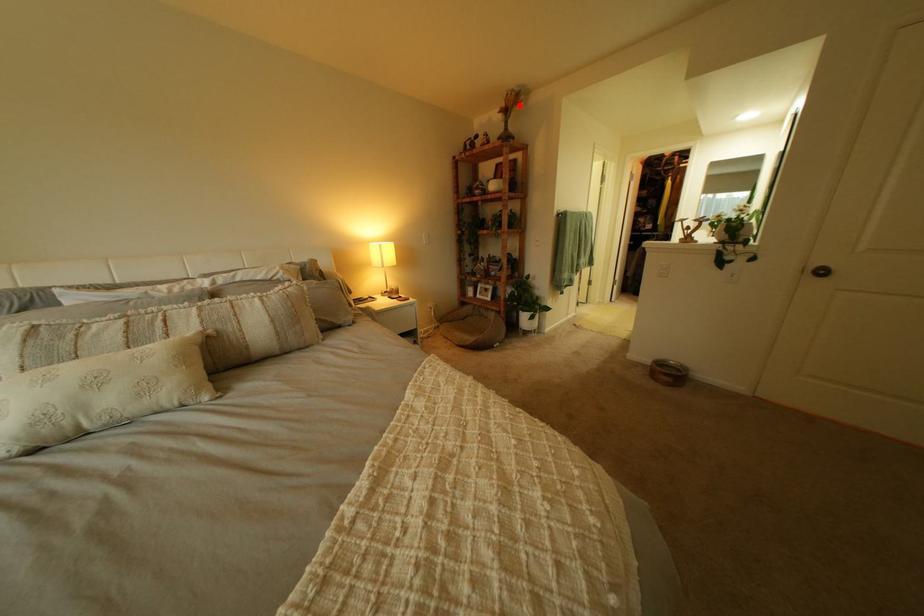
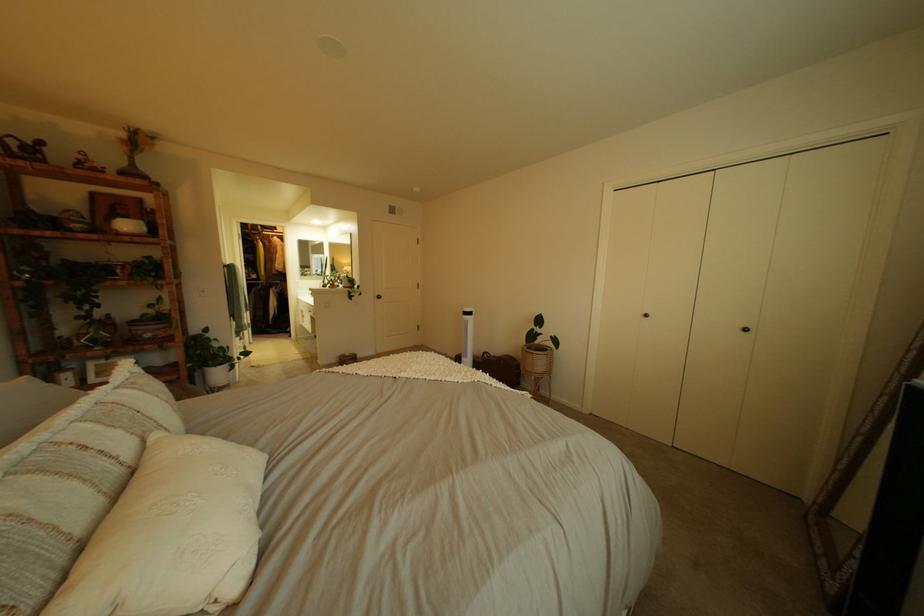
Question: I am providing you with two images of the same scene from different viewpoints. In image1, a red point is highlighted. Considering the same 3D point in image2, which of the following is correct?

Choices:
 (A) It is closer
 (B) It is farther

Answer: (B)